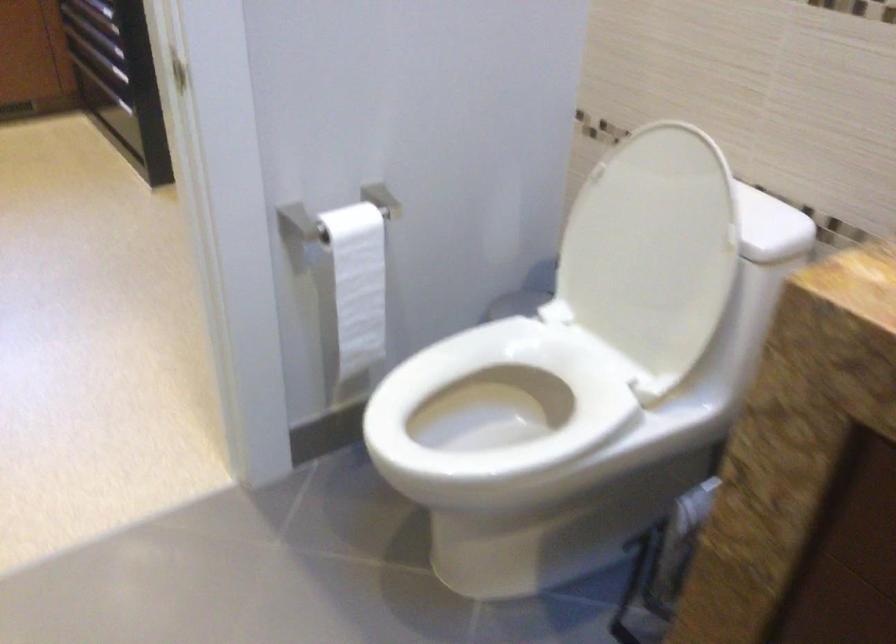
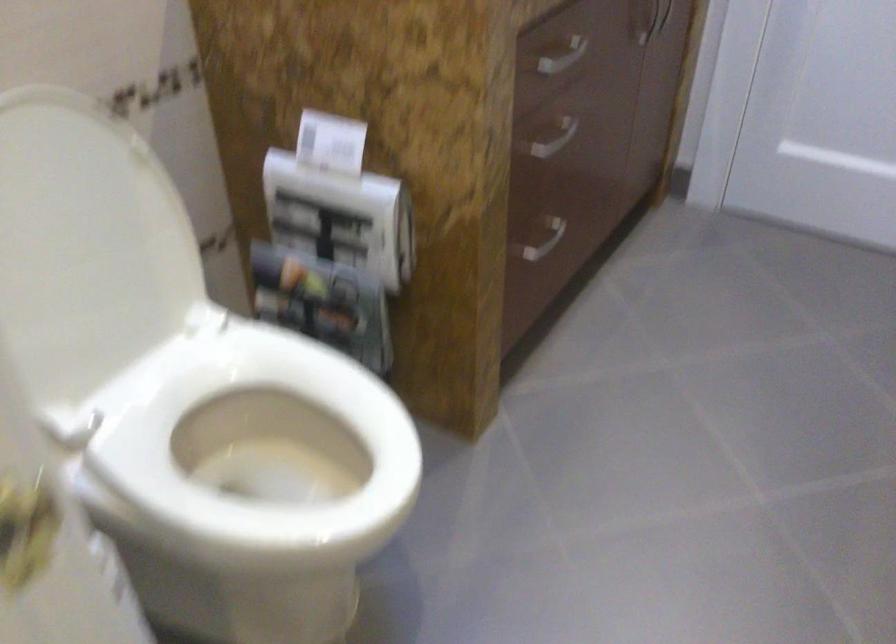
Where in the second image is the point corresponding to pixel 609 493 from the first image?

(257, 438)